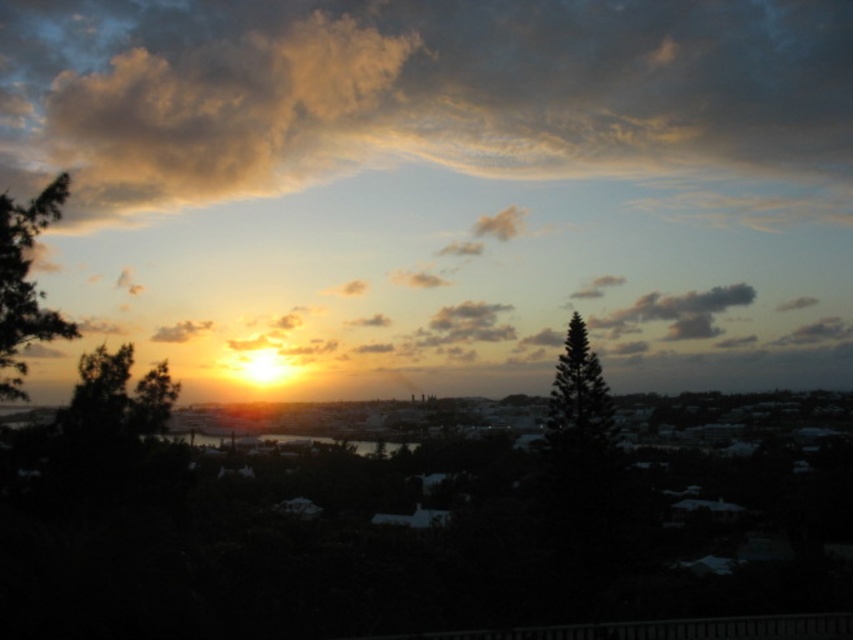
You are standing at the point marked as point (115, 397) in the image. What object is located exactly at this point?

The green leafy tree at center is located exactly at point (115, 397).

You are an artist trying to paint the sunset scene. You have a canvas that can only fit the width of the green leafy tree at left. Can you fit the green textured pine tree at center on your canvas?

The green leafy tree at left is narrower than the green textured pine tree at center, so the pine tree cannot fit on the canvas designed for the narrower tree.